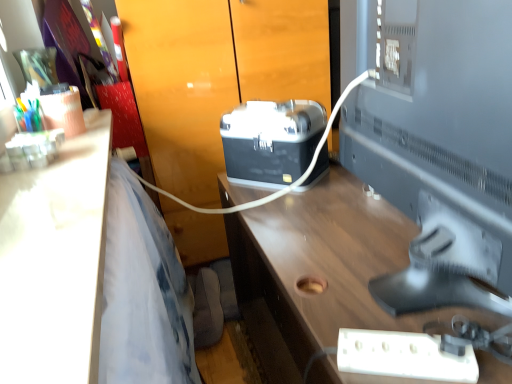
Question: Does matte black toolbox at center have a larger size compared to white glossy desk at left, the second desk viewed from the right?

Choices:
 (A) no
 (B) yes

Answer: (B)

Question: Is matte black toolbox at center closer to camera compared to white glossy desk at left, which is the first desk from left to right?

Choices:
 (A) yes
 (B) no

Answer: (B)

Question: From a real-world perspective, is matte black toolbox at center positioned over white glossy desk at left, the second desk viewed from the right, based on gravity?

Choices:
 (A) yes
 (B) no

Answer: (B)

Question: Considering the relative sizes of matte black toolbox at center and white glossy desk at left, the second desk viewed from the right, in the image provided, is matte black toolbox at center shorter than white glossy desk at left, the second desk viewed from the right,?

Choices:
 (A) yes
 (B) no

Answer: (B)

Question: Is matte black toolbox at center at the left side of white glossy desk at left, which is the first desk from left to right?

Choices:
 (A) no
 (B) yes

Answer: (A)

Question: Is matte black toolbox at center completely or partially outside of white glossy desk at left, the second desk viewed from the right?

Choices:
 (A) yes
 (B) no

Answer: (A)

Question: From the image's perspective, is wooden desk at center, which is the first desk in right-to-left order, below matte black toolbox at center?

Choices:
 (A) yes
 (B) no

Answer: (A)

Question: Considering the relative sizes of wooden desk at center, the second desk from the left, and matte black toolbox at center in the image provided, is wooden desk at center, the second desk from the left, wider than matte black toolbox at center?

Choices:
 (A) no
 (B) yes

Answer: (B)

Question: Does wooden desk at center, the second desk from the left, have a larger size compared to matte black toolbox at center?

Choices:
 (A) yes
 (B) no

Answer: (A)

Question: Is wooden desk at center, the second desk from the left, positioned in front of matte black toolbox at center?

Choices:
 (A) no
 (B) yes

Answer: (B)

Question: Are wooden desk at center, the second desk from the left, and matte black toolbox at center located far from each other?

Choices:
 (A) no
 (B) yes

Answer: (A)

Question: Is wooden desk at center, which is the first desk in right-to-left order, looking in the opposite direction of matte black toolbox at center?

Choices:
 (A) yes
 (B) no

Answer: (B)

Question: Is black plastic projector at center inside white plastic extension cord at lower right?

Choices:
 (A) no
 (B) yes

Answer: (A)